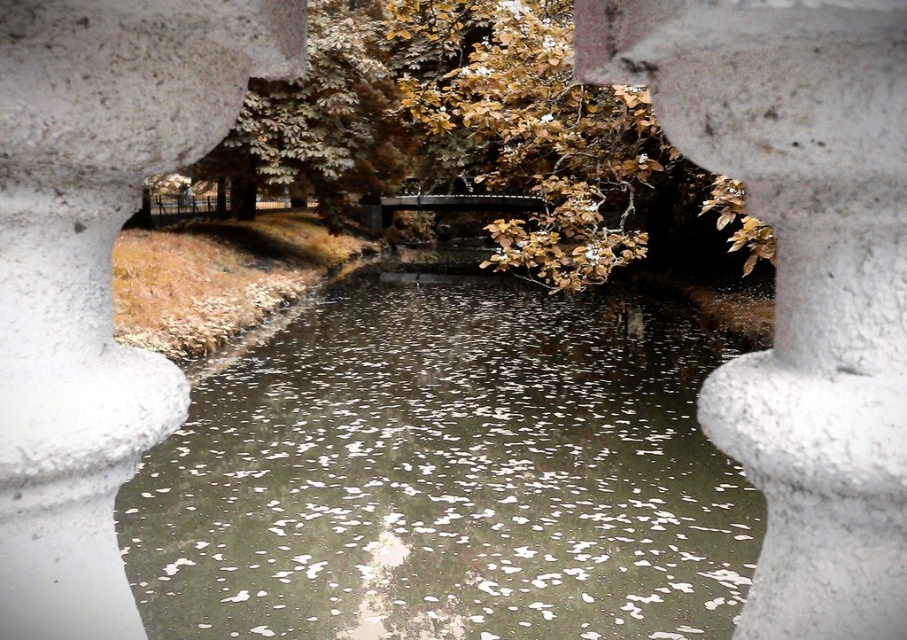
Is greenish reflective water at center wider than white stone pillar at center?

Yes, greenish reflective water at center is wider than white stone pillar at center.

Which is more to the right, greenish reflective water at center or white stone pillar at center?

greenish reflective water at center

Locate an element on the screen. greenish reflective water at center is located at coordinates 447,474.

Who is lower down, white textured pillar at center or white stone pillar at center?

white stone pillar at center is lower down.

Can you confirm if white textured pillar at center is positioned to the left of white stone pillar at center?

Incorrect, white textured pillar at center is not on the left side of white stone pillar at center.

You are a GUI agent. You are given a task and a screenshot of the screen. Output one action in this format:
    pyautogui.click(x=<x>, y=<y>)
    Task: Click on the white textured pillar at center
    
    Given the screenshot: What is the action you would take?
    pyautogui.click(x=798, y=276)

Does greenish reflective water at center appear on the right side of white textured pillar at center?

Yes, greenish reflective water at center is to the right of white textured pillar at center.

Who is positioned more to the right, greenish reflective water at center or white textured pillar at center?

From the viewer's perspective, greenish reflective water at center appears more on the right side.

What are the coordinates of `greenish reflective water at center` in the screenshot? It's located at (447, 474).